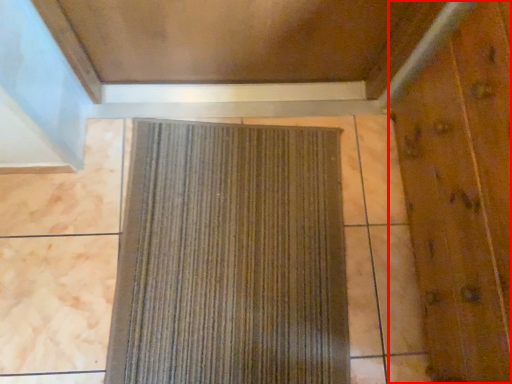
Question: Observing the image, what is the correct spatial positioning of elevator door (annotated by the red box) in reference to curtain?

Choices:
 (A) right
 (B) left

Answer: (A)